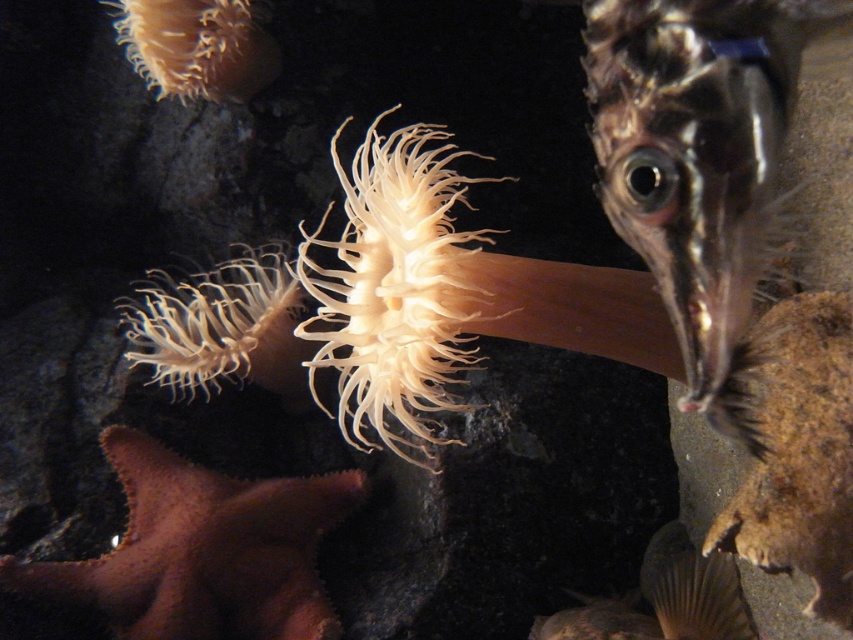
Is point (738, 93) closer to camera compared to point (262, 269)?

Yes, it is.

Between point (634, 241) and point (242, 312), which one is positioned behind?

Positioned behind is point (242, 312).

At what (x,y) coordinates should I click in order to perform the action: click on shiny silver fish at center. Please return your answer as a coordinate pair (x, y). Looking at the image, I should click on (695, 148).